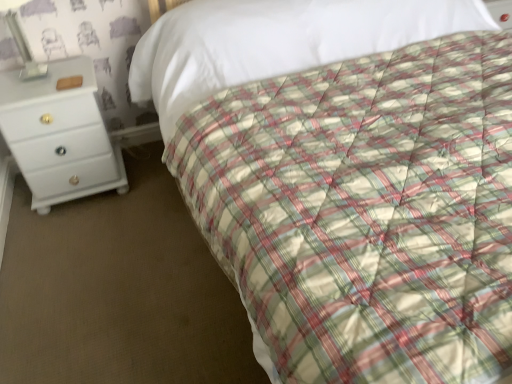
The height and width of the screenshot is (384, 512). Describe the element at coordinates (24, 50) in the screenshot. I see `metallic silver lamp at upper left` at that location.

Find the location of a particular element. The width and height of the screenshot is (512, 384). metallic silver lamp at upper left is located at coordinates coord(24,50).

The image size is (512, 384). What do you see at coordinates (59, 135) in the screenshot?
I see `white glossy chest of drawers at left` at bounding box center [59, 135].

Measure the distance between point (70, 65) and camera.

The distance of point (70, 65) from camera is 6.64 feet.

Where is `white glossy chest of drawers at left`? The width and height of the screenshot is (512, 384). white glossy chest of drawers at left is located at coordinates (59, 135).

The image size is (512, 384). Identify the location of metallic silver lamp at upper left. (24, 50).

Based on the photo, can you confirm if metallic silver lamp at upper left is positioned to the right of white glossy chest of drawers at left?

In fact, metallic silver lamp at upper left is to the left of white glossy chest of drawers at left.

Does metallic silver lamp at upper left lie behind white glossy chest of drawers at left?

No, metallic silver lamp at upper left is closer to the camera.

Between point (40, 74) and point (59, 150), which one is positioned behind?

The point (59, 150) is behind.

From the image's perspective, who appears lower, metallic silver lamp at upper left or white glossy chest of drawers at left?

white glossy chest of drawers at left appears lower in the image.

From a real-world perspective, is metallic silver lamp at upper left over white glossy chest of drawers at left?

Yes.

Which of these two, metallic silver lamp at upper left or white glossy chest of drawers at left, is thinner?

Thinner between the two is metallic silver lamp at upper left.

Considering the sizes of objects metallic silver lamp at upper left and white glossy chest of drawers at left in the image provided, who is shorter, metallic silver lamp at upper left or white glossy chest of drawers at left?

metallic silver lamp at upper left is shorter.

Does metallic silver lamp at upper left have a larger size compared to white glossy chest of drawers at left?

Actually, metallic silver lamp at upper left might be smaller than white glossy chest of drawers at left.

Is metallic silver lamp at upper left outside of white glossy chest of drawers at left?

Yes, metallic silver lamp at upper left is located beyond the bounds of white glossy chest of drawers at left.

Is metallic silver lamp at upper left far away from white glossy chest of drawers at left?

That's not correct — metallic silver lamp at upper left is a little close to white glossy chest of drawers at left.

Is metallic silver lamp at upper left positioned with its back to white glossy chest of drawers at left?

No, metallic silver lamp at upper left is not facing away from white glossy chest of drawers at left.

How many degrees apart are the facing directions of metallic silver lamp at upper left and white glossy chest of drawers at left?

1.54 degrees separate the facing orientations of metallic silver lamp at upper left and white glossy chest of drawers at left.

Find the location of a particular element. This screenshot has height=384, width=512. bedside lamp above the white glossy chest of drawers at left (from the image's perspective) is located at coordinates (24, 50).

Considering the positions of objects white glossy chest of drawers at left and metallic silver lamp at upper left in the image provided, who is more to the right, white glossy chest of drawers at left or metallic silver lamp at upper left?

From the viewer's perspective, white glossy chest of drawers at left appears more on the right side.

Is white glossy chest of drawers at left in front of metallic silver lamp at upper left?

Answer: No, white glossy chest of drawers at left is further to the viewer.

Which point is more forward, (91,94) or (16,44)?

The point (16,44) is closer to the camera.

From the image's perspective, who appears lower, white glossy chest of drawers at left or metallic silver lamp at upper left?

white glossy chest of drawers at left is shown below in the image.

From a real-world perspective, relative to metallic silver lamp at upper left, is white glossy chest of drawers at left vertically above or below?

In terms of real-world spatial position, white glossy chest of drawers at left is below metallic silver lamp at upper left.

Is white glossy chest of drawers at left wider or thinner than metallic silver lamp at upper left?

In the image, white glossy chest of drawers at left appears to be wider than metallic silver lamp at upper left.

Who is shorter, white glossy chest of drawers at left or metallic silver lamp at upper left?

Standing shorter between the two is metallic silver lamp at upper left.

Can you confirm if white glossy chest of drawers at left is bigger than metallic silver lamp at upper left?

Indeed, white glossy chest of drawers at left has a larger size compared to metallic silver lamp at upper left.

Could metallic silver lamp at upper left be considered to be inside white glossy chest of drawers at left?

Actually, metallic silver lamp at upper left is outside white glossy chest of drawers at left.

Is the surface of white glossy chest of drawers at left in direct contact with metallic silver lamp at upper left?

No, white glossy chest of drawers at left is not making contact with metallic silver lamp at upper left.

Is white glossy chest of drawers at left oriented away from metallic silver lamp at upper left?

white glossy chest of drawers at left does not have its back to metallic silver lamp at upper left.

Measure the distance between white glossy chest of drawers at left and metallic silver lamp at upper left.

A distance of 11.65 inches exists between white glossy chest of drawers at left and metallic silver lamp at upper left.

The image size is (512, 384). Identify the location of bedside lamp above the white glossy chest of drawers at left (from a real-world perspective). coord(24,50).

Find the location of `bedside lamp lying on the left of white glossy chest of drawers at left`. bedside lamp lying on the left of white glossy chest of drawers at left is located at coordinates (24, 50).

Identify the location of bedside lamp that is above the white glossy chest of drawers at left (from the image's perspective). The height and width of the screenshot is (384, 512). (24, 50).